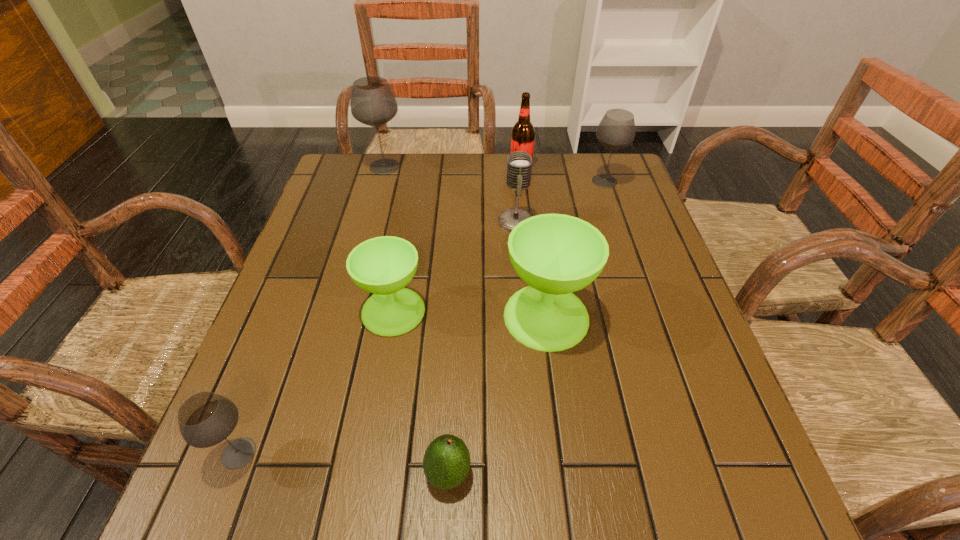
Locate an element on the screen. The width and height of the screenshot is (960, 540). vacant area at the near edge is located at coordinates (390, 487).

Where is `vacant area at the left edge`? vacant area at the left edge is located at coordinates (340, 206).

The image size is (960, 540). Find the location of `vacant space at the right edge of the desktop`. vacant space at the right edge of the desktop is located at coordinates (723, 418).

Locate an element on the screen. The height and width of the screenshot is (540, 960). vacant region at the far left corner of the desktop is located at coordinates click(330, 186).

At what (x,y) coordinates should I click in order to perform the action: click on vacant area at the near left corner. Please return your answer as a coordinate pair (x, y). Looking at the image, I should click on tap(242, 484).

In the image, there is a desktop. Identify the location of vacant space at the far right corner. (599, 154).

This screenshot has height=540, width=960. What are the coordinates of `unoccupied position between the shortest object and the bigger green wineglass` in the screenshot? It's located at tap(497, 395).

Where is `free point between the second gray wineglass from right to left and the right green wineglass`? Image resolution: width=960 pixels, height=540 pixels. free point between the second gray wineglass from right to left and the right green wineglass is located at coordinates (466, 241).

At what (x,y) coordinates should I click in order to perform the action: click on free area in between the tallest wineglass and the rightmost gray wineglass. Please return your answer as a coordinate pair (x, y). The width and height of the screenshot is (960, 540). Looking at the image, I should click on (494, 174).

Where is `free point between the gray microphone and the leftmost gray wineglass`? This screenshot has width=960, height=540. free point between the gray microphone and the leftmost gray wineglass is located at coordinates (377, 338).